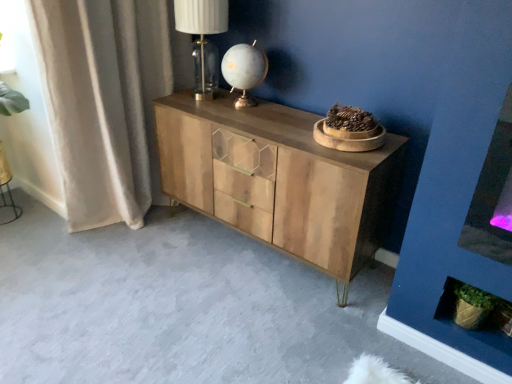
Question: Considering their positions, is beige fabric curtain at left located in front of or behind translucent glass table lamp at upper center, which appears as the first table lamp when viewed from the left?

Choices:
 (A) front
 (B) behind

Answer: (A)

Question: Looking at the image, does beige fabric curtain at left seem bigger or smaller compared to translucent glass table lamp at upper center, which appears as the first table lamp when viewed from the left?

Choices:
 (A) small
 (B) big

Answer: (B)

Question: Based on their relative distances, which object is nearer to the matte glass table lamp at center, acting as the second table lamp starting from the left?

Choices:
 (A) translucent glass table lamp at upper center, arranged as the second table lamp when viewed from the right
 (B) natural wood cabinet at center
 (C) beige fabric curtain at left

Answer: (A)

Question: Considering the real-world distances, which object is closest to the beige fabric curtain at left?

Choices:
 (A) matte glass table lamp at center, the 1th table lamp from the right
 (B) translucent glass table lamp at upper center, arranged as the second table lamp when viewed from the right
 (C) natural wood cabinet at center

Answer: (B)